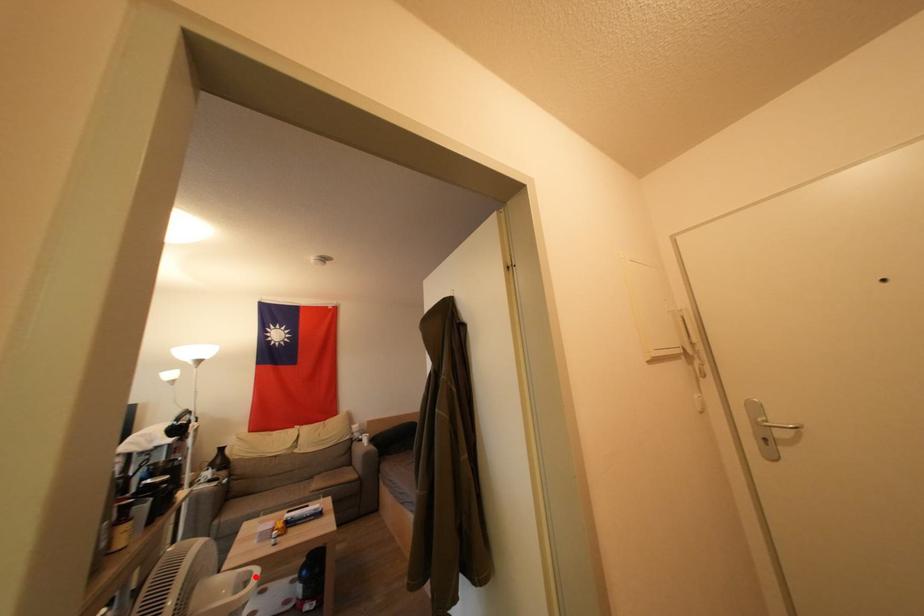
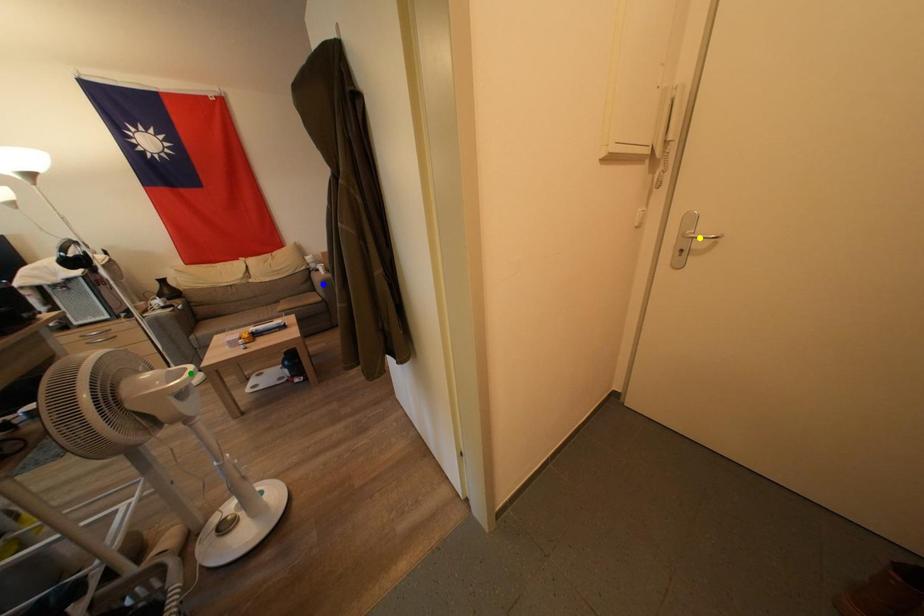
Question: I am providing you with two images of the same scene from different viewpoints. A red point is marked on the first image. You are given multiple points on the second image. In image 2, which mark is for the same physical point as the one in image 1?

Choices:
 (A) blue point
 (B) yellow point
 (C) green point

Answer: (C)